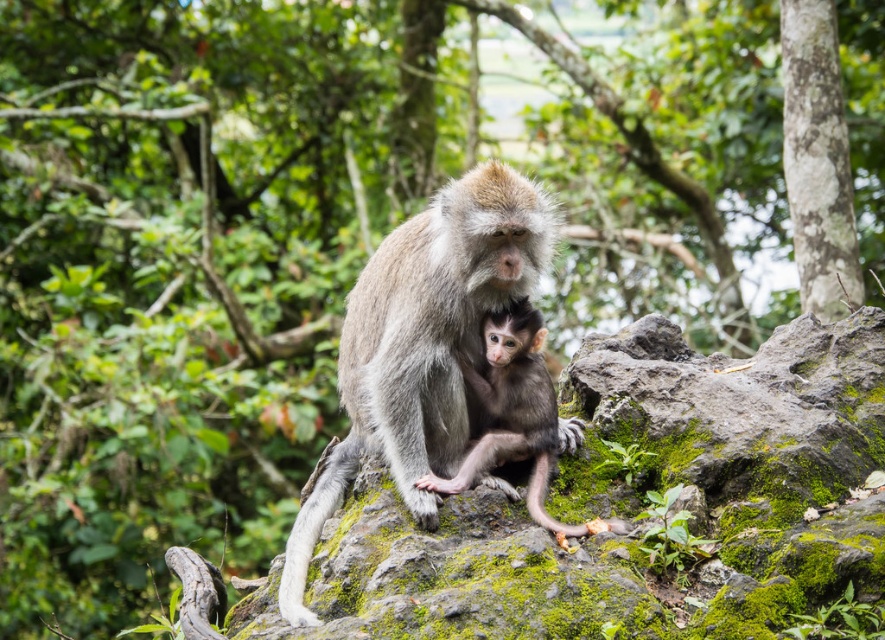
Image resolution: width=885 pixels, height=640 pixels. What do you see at coordinates (421, 346) in the screenshot? I see `gray fur monkey at center` at bounding box center [421, 346].

Which is behind, point (527, 248) or point (429, 484)?

The point (527, 248) is more distant.

Where is `gray fur monkey at center`? gray fur monkey at center is located at coordinates (421, 346).

Can you confirm if green mossy rock at center is positioned above gray fur monkey at center?

No, green mossy rock at center is not above gray fur monkey at center.

Between green mossy rock at center and gray fur monkey at center, which one is positioned higher?

gray fur monkey at center is above.

Is point (693, 568) in front of point (419, 298)?

Yes, it is in front of point (419, 298).

This screenshot has height=640, width=885. I want to click on green mossy rock at center, so click(x=633, y=502).

Is point (421, 536) positioned after point (455, 477)?

No.

How much distance is there between green mossy rock at center and gray furry monkey at center?

10.31 inches

Is point (328, 564) farther from viewer compared to point (473, 452)?

No, (328, 564) is in front of (473, 452).

The width and height of the screenshot is (885, 640). Find the location of `green mossy rock at center`. green mossy rock at center is located at coordinates (633, 502).